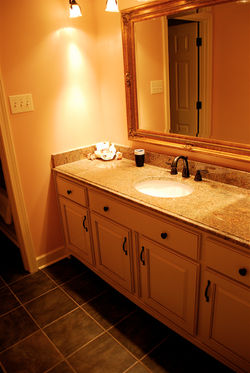
Locate an element on the screen. This screenshot has height=373, width=250. tile floor is located at coordinates (21, 319).